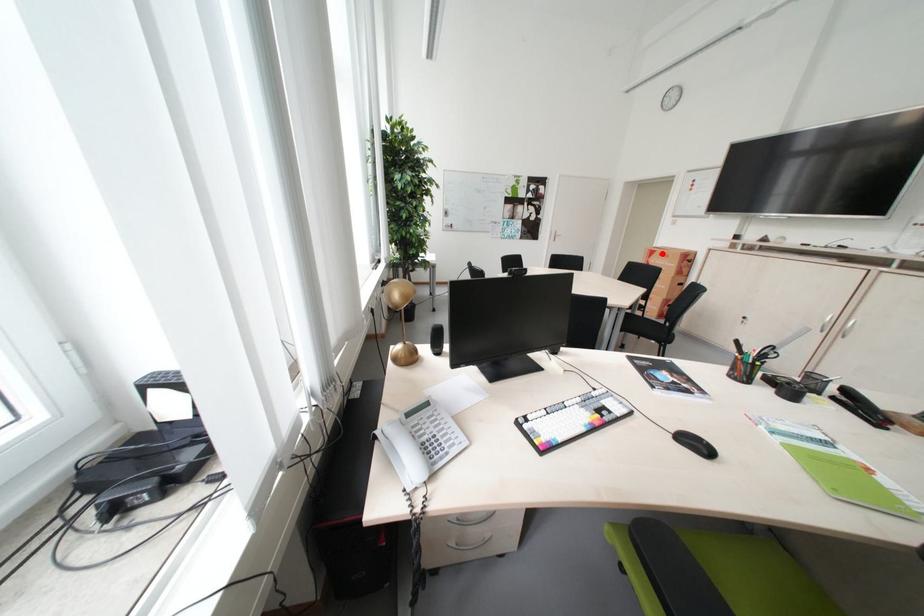
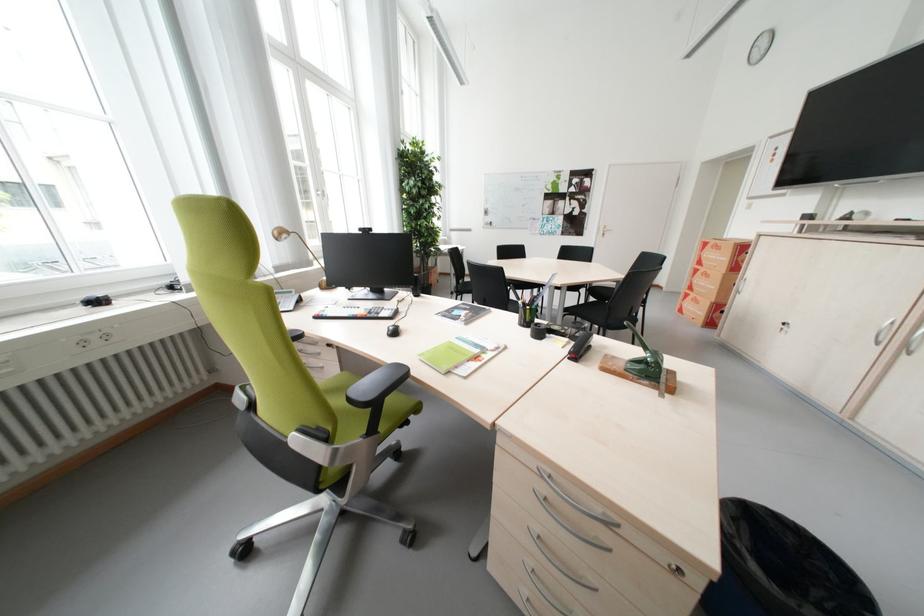
Locate, in the second image, the point that corresponds to the highlighted location in the first image.

(715, 246)